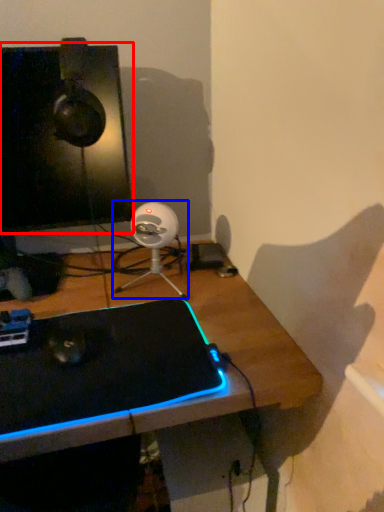
Question: Among these objects, which one is farthest to the camera, computer monitor (highlighted by a red box) or fan (highlighted by a blue box)?

Choices:
 (A) computer monitor
 (B) fan

Answer: (B)